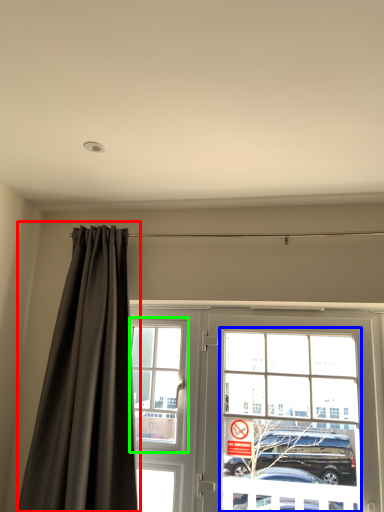
Question: Considering the real-world distances, which object is farthest from curtain (highlighted by a red box)? bay window (highlighted by a blue box) or window (highlighted by a green box)?

Choices:
 (A) bay window
 (B) window

Answer: (A)